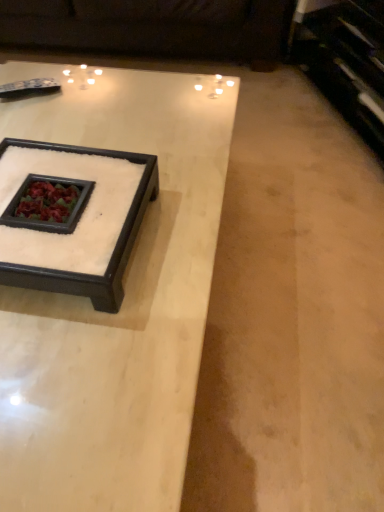
Locate an element on the screen. vacant space to the right of white marble coffee table at center, which ranks as the first coffee table in front-to-back order is located at coordinates (295, 287).